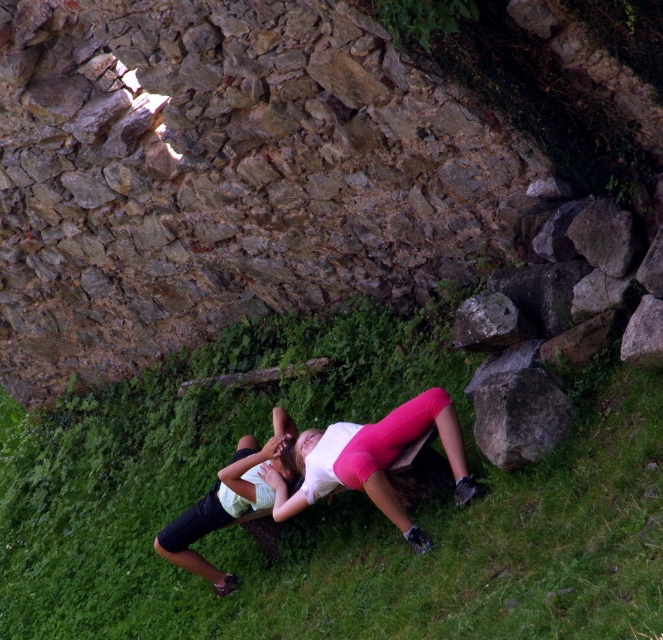
Based on the photo, you are a photographer trying to capture the scene where the two individuals are posing. You need to ensure that both the white matte leggings at center and the white matte shorts at lower center are clearly visible in the frame. Given their sizes, which of these two items might require you to adjust your camera angle to avoid being cropped out?

The white matte leggings at center has a larger size compared to the white matte shorts at lower center, so it might require adjusting the camera angle to ensure it fits entirely within the frame without being cropped out.

You are a photographer standing at the camera position. You want to capture a closeup shot of the white matte leggings at center. Given that your camera has a minimum focusing distance of 2 meters, will you be able to take the photo without moving closer?

The distance between the white matte leggings at center and the camera is 3.90 meters, which is greater than the minimum focusing distance of 2 meters. Therefore, you can take the photo without moving closer.